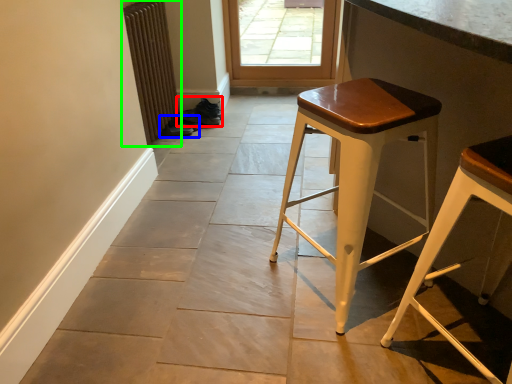
Question: Which object is the farthest from shoe (highlighted by a red box)? Choose among these: shoe (highlighted by a blue box) or radiator (highlighted by a green box).

Choices:
 (A) shoe
 (B) radiator

Answer: (B)